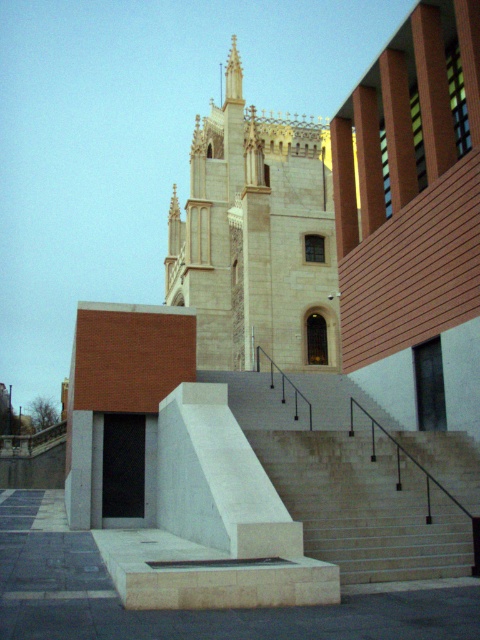
Is point (308, 257) farther from viewer compared to point (289, 394)?

Yes, it is.

Does point (264, 326) lie in front of point (425, 433)?

No, (264, 326) is further to viewer.

Locate an element on the screen. This screenshot has width=480, height=640. light beige stone tower at center is located at coordinates (255, 237).